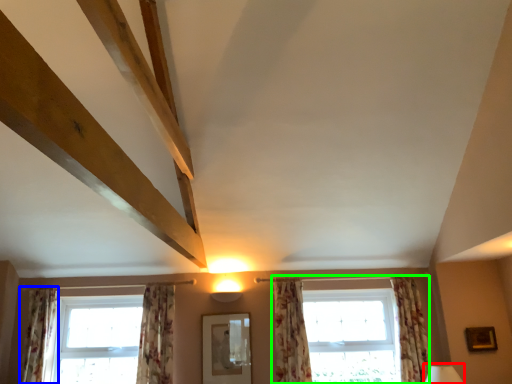
Question: Estimate the real-world distances between objects in this image. Which object is closer to table lamp (highlighted by a red box), curtain (highlighted by a blue box) or window (highlighted by a green box)?

Choices:
 (A) curtain
 (B) window

Answer: (B)